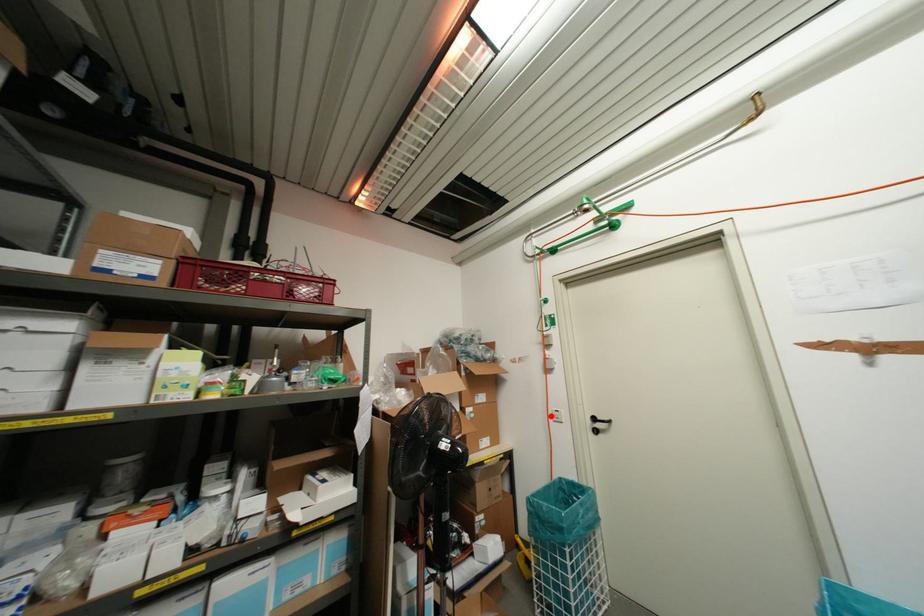
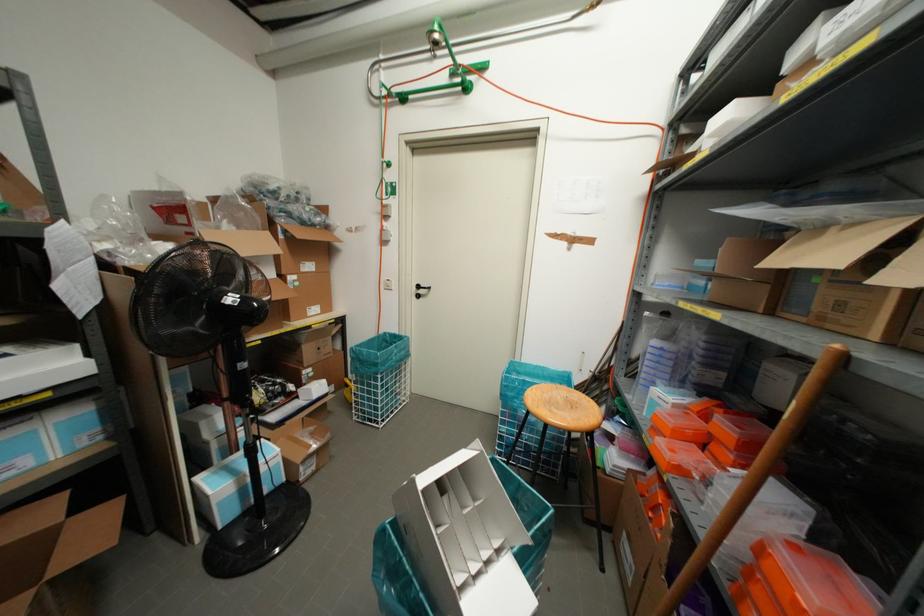
Find the pixel in the second image that matches the highlighted location in the first image.

(382, 285)